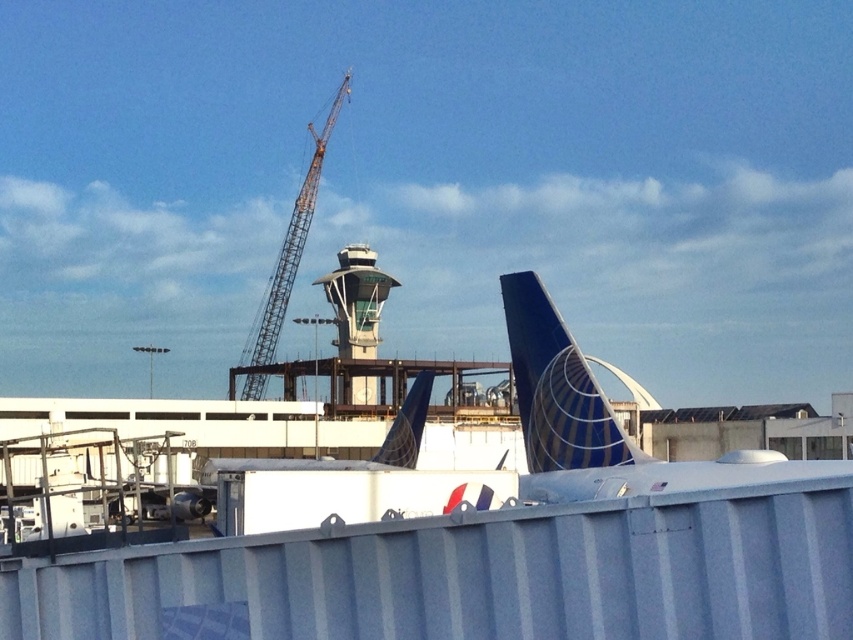
Question: Is green glass control tower at center to the right of metallic gray crane at center from the viewer's perspective?

Choices:
 (A) no
 (B) yes

Answer: (B)

Question: Can you confirm if metallic gray crane at center is bigger than blue painted tail fin at center?

Choices:
 (A) no
 (B) yes

Answer: (B)

Question: Which of the following is the farthest from the observer?

Choices:
 (A) (338, 99)
 (B) (380, 452)
 (C) (550, 320)
 (D) (373, 330)

Answer: (A)

Question: Which point is farther to the camera?

Choices:
 (A) (416, 445)
 (B) (379, 337)
 (C) (271, 340)
 (D) (569, 404)

Answer: (C)

Question: Among these objects, which one is farthest from the camera?

Choices:
 (A) metallic gray crane at center
 (B) blue painted tail fin at center
 (C) blue glossy tail fin at center
 (D) green glass control tower at center

Answer: (A)

Question: Does green glass control tower at center have a lesser width compared to blue painted tail fin at center?

Choices:
 (A) no
 (B) yes

Answer: (A)